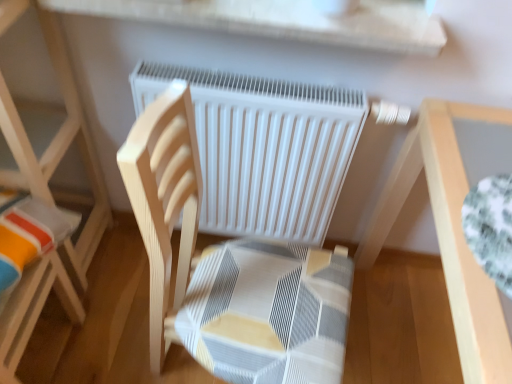
Question: Would you say light wood chair at left is to the left or to the right of wooden chair at center in the picture?

Choices:
 (A) left
 (B) right

Answer: (A)

Question: Considering the positions of light wood chair at left and wooden chair at center in the image, is light wood chair at left wider or thinner than wooden chair at center?

Choices:
 (A) thin
 (B) wide

Answer: (A)

Question: Which of these objects is positioned farthest from the white matte radiator at center?

Choices:
 (A) light wood table at right
 (B) wooden chair at center
 (C) light wood chair at left

Answer: (C)

Question: Which of these objects is positioned closest to the wooden chair at center?

Choices:
 (A) light wood table at right
 (B) light wood chair at left
 (C) white matte radiator at center

Answer: (C)